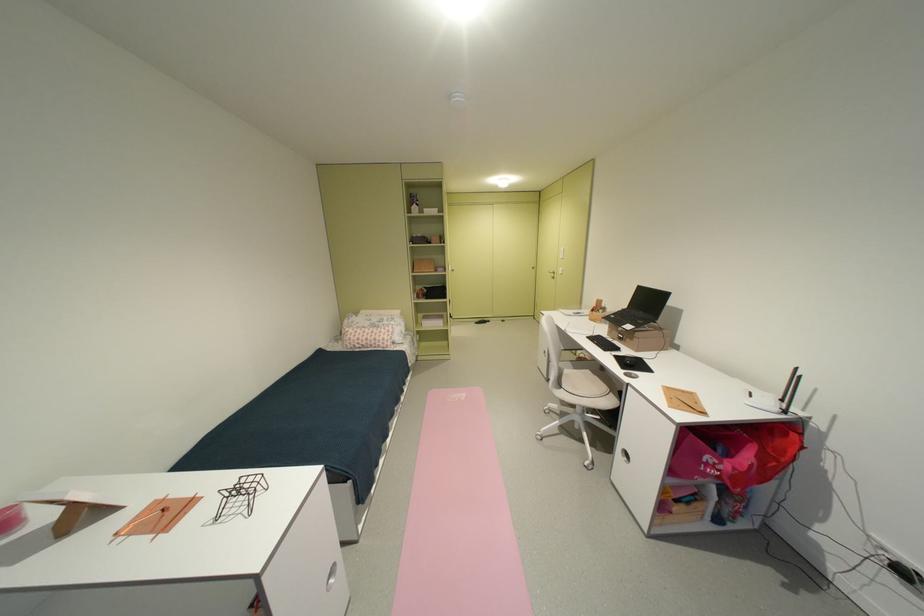
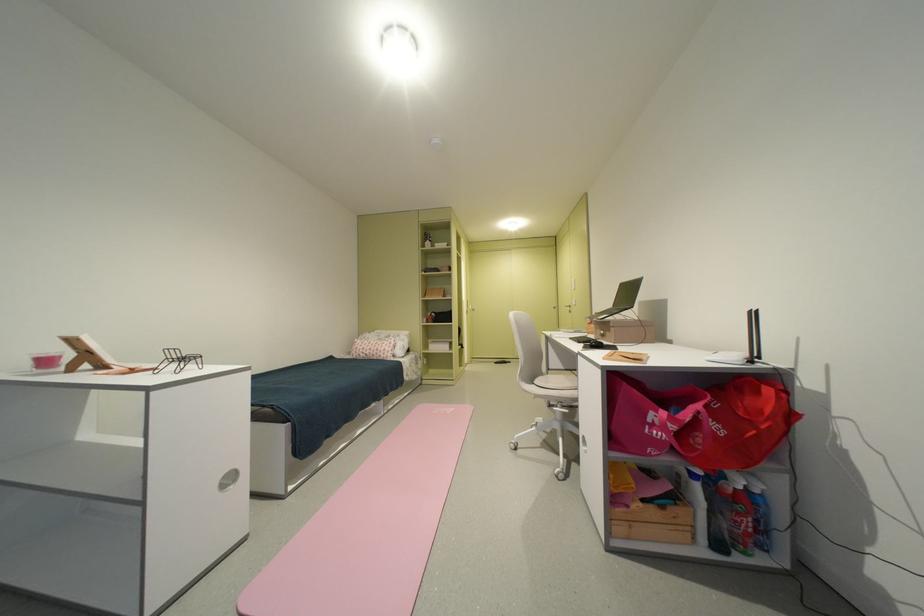
Where in the second image is the point corresponding to (784,464) from the first image?

(764, 434)